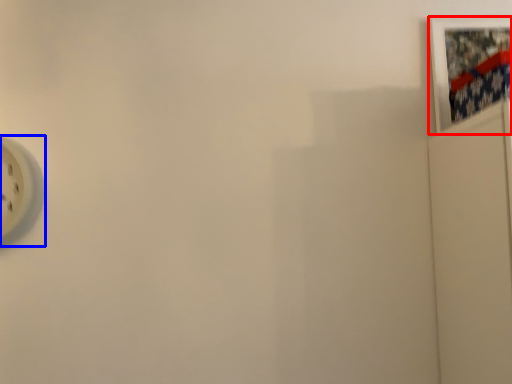
Question: Which point is closer to the camera, picture frame (highlighted by a red box) or wall clock (highlighted by a blue box)?

Choices:
 (A) picture frame
 (B) wall clock

Answer: (B)